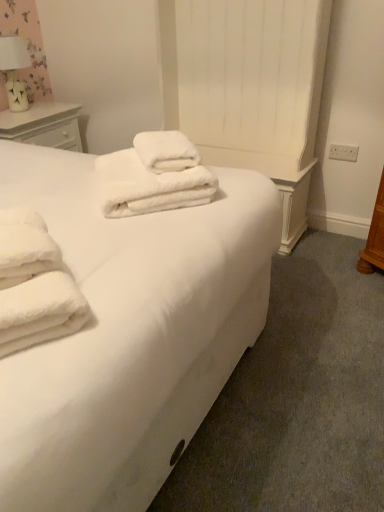
Question: Could you tell me if white ceramic table lamp at upper left is turned towards white soft towels at center?

Choices:
 (A) yes
 (B) no

Answer: (B)

Question: Does white ceramic table lamp at upper left appear on the right side of white soft towels at center?

Choices:
 (A) no
 (B) yes

Answer: (A)

Question: Is white ceramic table lamp at upper left bigger than white soft towels at center?

Choices:
 (A) yes
 (B) no

Answer: (B)

Question: Does white ceramic table lamp at upper left have a greater height compared to white soft towels at center?

Choices:
 (A) yes
 (B) no

Answer: (B)

Question: Is the depth of white ceramic table lamp at upper left less than that of white soft towels at center?

Choices:
 (A) yes
 (B) no

Answer: (B)

Question: Is white ceramic table lamp at upper left positioned beyond the bounds of white soft towels at center?

Choices:
 (A) yes
 (B) no

Answer: (A)

Question: From a real-world perspective, is white fluffy towels at center below white ceramic table lamp at upper left?

Choices:
 (A) yes
 (B) no

Answer: (A)

Question: Is white fluffy towels at center not near white ceramic table lamp at upper left?

Choices:
 (A) yes
 (B) no

Answer: (A)

Question: Is white fluffy towels at center shorter than white ceramic table lamp at upper left?

Choices:
 (A) no
 (B) yes

Answer: (B)

Question: Does white fluffy towels at center have a lesser width compared to white ceramic table lamp at upper left?

Choices:
 (A) yes
 (B) no

Answer: (B)

Question: Is white fluffy towels at center smaller than white ceramic table lamp at upper left?

Choices:
 (A) yes
 (B) no

Answer: (A)

Question: From a real-world perspective, is white fluffy towels at center physically above white ceramic table lamp at upper left?

Choices:
 (A) yes
 (B) no

Answer: (B)

Question: Is white soft towels at center located outside white wood nightstand at upper left?

Choices:
 (A) yes
 (B) no

Answer: (A)